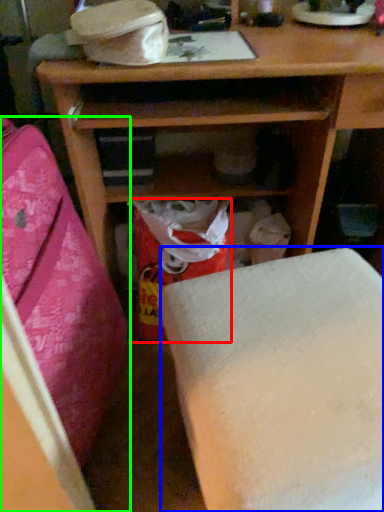
Question: Based on their relative distances, which object is nearer to shopping bag (highlighted by a red box)? Choose from furniture (highlighted by a blue box) and furniture (highlighted by a green box).

Choices:
 (A) furniture
 (B) furniture

Answer: (B)